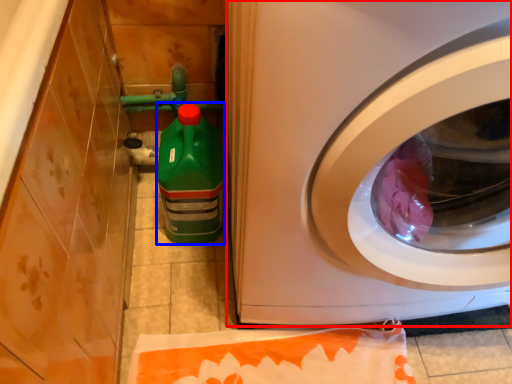
Question: Which of the following is the farthest to the observer, washing machine (highlighted by a red box) or cleaning product (highlighted by a blue box)?

Choices:
 (A) washing machine
 (B) cleaning product

Answer: (B)